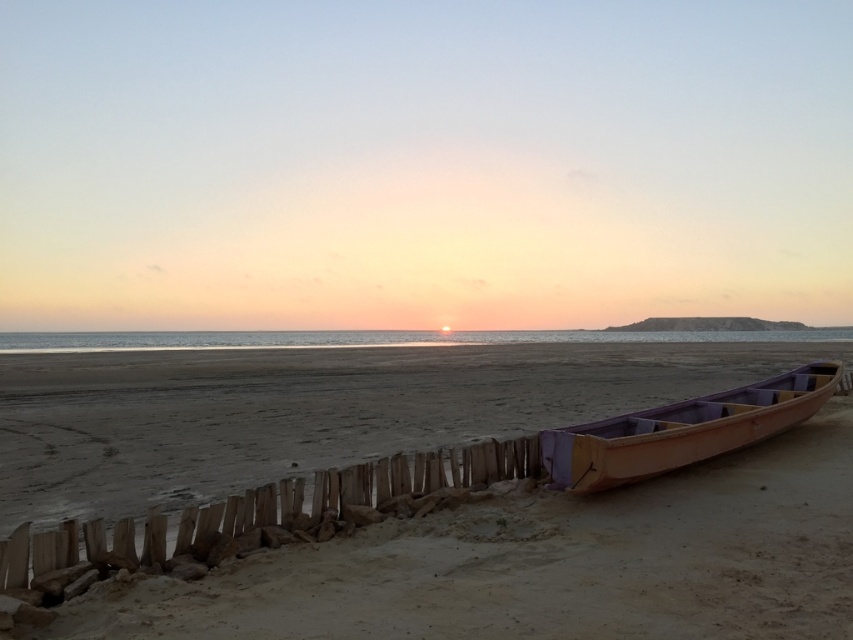
Consider the image. Is wooden boat at lower right smaller than wooden canoe at right?

Actually, wooden boat at lower right might be larger than wooden canoe at right.

Is point (16, 397) less distant than point (631, 444)?

No, it is not.

At what (x,y) coordinates should I click in order to perform the action: click on wooden boat at lower right. Please return your answer as a coordinate pair (x, y). This screenshot has width=853, height=640. Looking at the image, I should click on (550, 564).